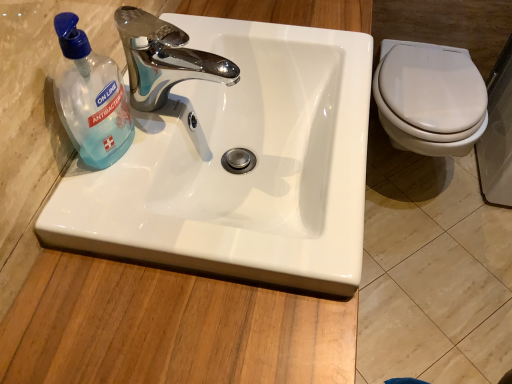
Identify the location of unoccupied area in front of transparent plastic bottle at left. The image size is (512, 384). (111, 207).